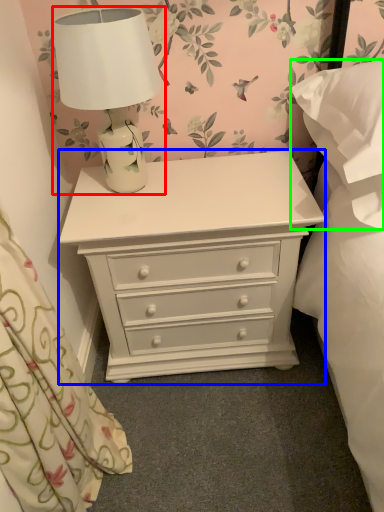
Question: Based on their relative distances, which object is nearer to lamp (highlighted by a red box)? Choose from chest of drawers (highlighted by a blue box) and pillow (highlighted by a green box).

Choices:
 (A) chest of drawers
 (B) pillow

Answer: (A)